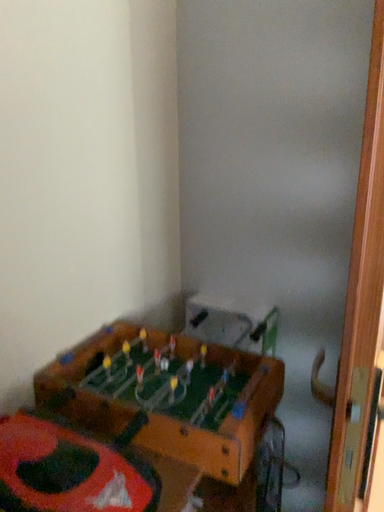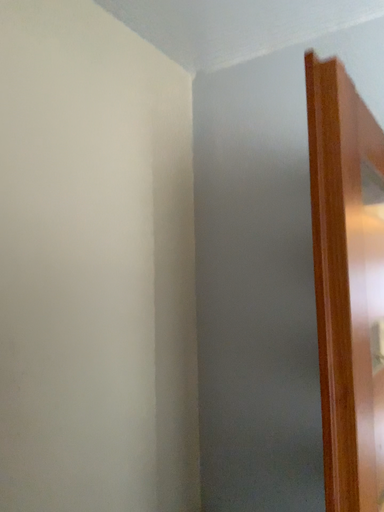
Question: Which way did the camera rotate in the video?

Choices:
 (A) rotated downward
 (B) rotated upward

Answer: (B)